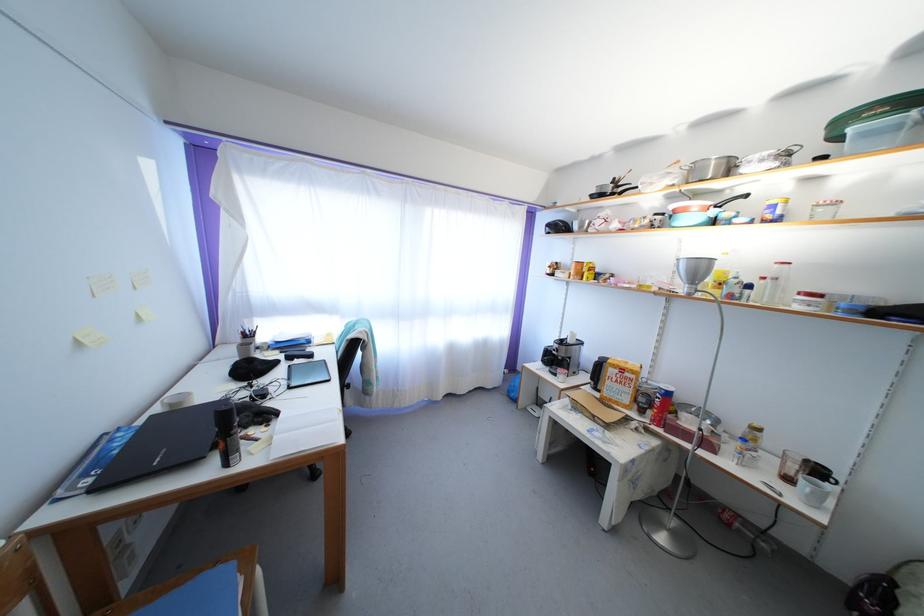
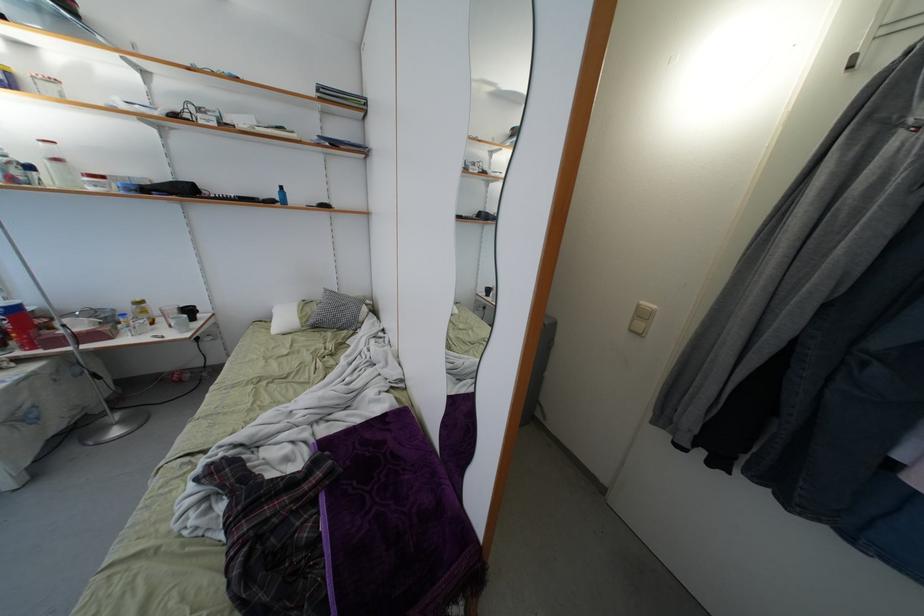
Locate, in the second image, the point that corresponds to the point at 760,446 in the first image.

(149, 317)